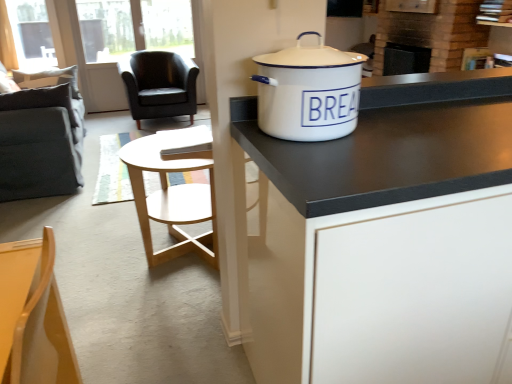
Question: Should I look upward or downward to see white enamel pot at upper right?

Choices:
 (A) up
 (B) down

Answer: (A)

Question: From the image's perspective, would you say black leather chair at upper left, placed as the first chair when sorted from back to front, is positioned over dark gray fabric swivel chair at left?

Choices:
 (A) no
 (B) yes

Answer: (B)

Question: Considering the relative sizes of black leather chair at upper left, arranged as the first chair when viewed from the top, and dark gray fabric swivel chair at left in the image provided, is black leather chair at upper left, arranged as the first chair when viewed from the top, bigger than dark gray fabric swivel chair at left?

Choices:
 (A) yes
 (B) no

Answer: (B)

Question: Is the position of black leather chair at upper left, the 2th chair when ordered from bottom to top, more distant than that of dark gray fabric swivel chair at left?

Choices:
 (A) yes
 (B) no

Answer: (A)

Question: Does black leather chair at upper left, placed as the first chair when sorted from back to front, have a greater height compared to dark gray fabric swivel chair at left?

Choices:
 (A) no
 (B) yes

Answer: (A)

Question: From a real-world perspective, is black leather chair at upper left, the 2th chair when ordered from bottom to top, below dark gray fabric swivel chair at left?

Choices:
 (A) yes
 (B) no

Answer: (A)

Question: Is black leather chair at upper left, placed as the first chair when sorted from back to front, positioned in front of dark gray fabric swivel chair at left?

Choices:
 (A) yes
 (B) no

Answer: (B)

Question: Considering the relative sizes of dark gray fabric swivel chair at left and white enamel pot at upper right in the image provided, is dark gray fabric swivel chair at left taller than white enamel pot at upper right?

Choices:
 (A) yes
 (B) no

Answer: (A)

Question: Does dark gray fabric swivel chair at left come behind white enamel pot at upper right?

Choices:
 (A) yes
 (B) no

Answer: (A)

Question: Is dark gray fabric swivel chair at left to the right of white enamel pot at upper right from the viewer's perspective?

Choices:
 (A) yes
 (B) no

Answer: (B)

Question: From the image's perspective, would you say dark gray fabric swivel chair at left is positioned over white enamel pot at upper right?

Choices:
 (A) no
 (B) yes

Answer: (B)

Question: From a real-world perspective, is dark gray fabric swivel chair at left located higher than white enamel pot at upper right?

Choices:
 (A) no
 (B) yes

Answer: (A)

Question: Is dark gray fabric swivel chair at left bigger than white enamel pot at upper right?

Choices:
 (A) yes
 (B) no

Answer: (A)

Question: Is black matte cabinet at center with white enamel pot at upper right?

Choices:
 (A) yes
 (B) no

Answer: (B)